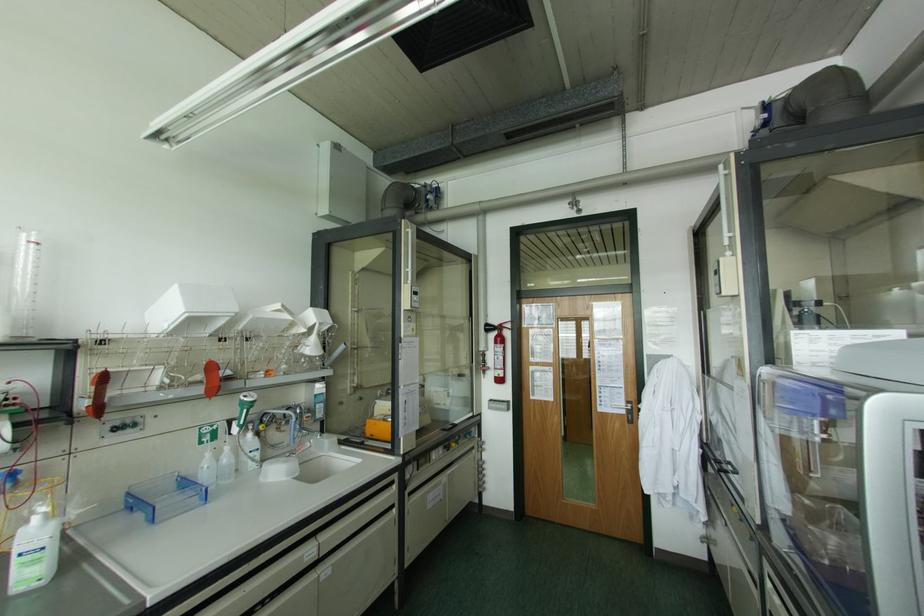
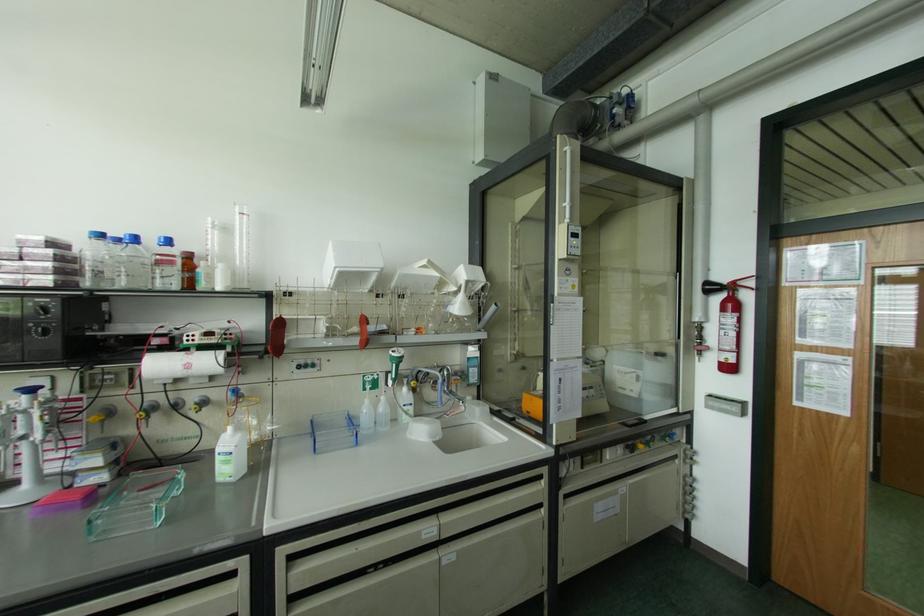
Locate, in the second image, the point that corresponds to point 53,523 in the first image.

(238, 435)